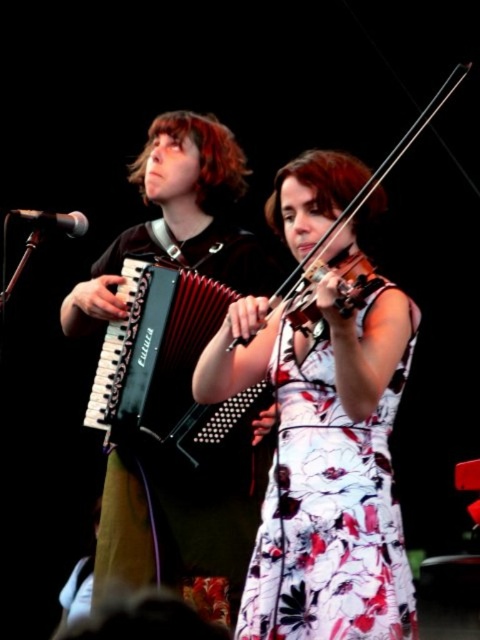
You are a stagehand setting up for a performance. You need to adjust the lighting to focus on the wooden violin at center and the black matte microphone at upper left. Which object is positioned lower on the stage?

The wooden violin at center is located below the black matte microphone at upper left, so it is positioned lower on the stage.

You are designing a stage backdrop that needs to accommodate both the floral printed dress at center and the black matte microphone at upper left. Given their sizes, which object requires more horizontal space to display properly?

The floral printed dress at center requires more horizontal space because its width is larger than the black matte microphone at upper left.